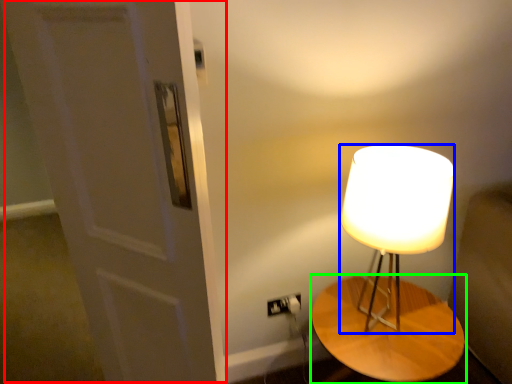
Question: Considering the real-world distances, which object is farthest from door (highlighted by a red box)? lamp (highlighted by a blue box) or table (highlighted by a green box)?

Choices:
 (A) lamp
 (B) table

Answer: (B)